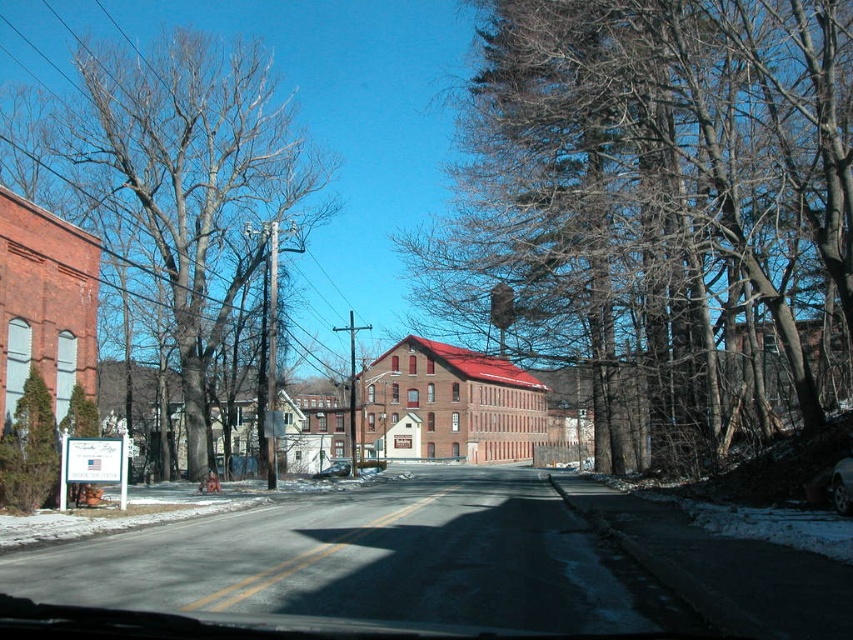
Question: Among these points, which one is nearest to the camera?

Choices:
 (A) (251, 96)
 (B) (837, 500)
 (C) (331, 476)

Answer: (B)

Question: Does brown bark tree at left have a smaller size compared to shiny black car at center?

Choices:
 (A) yes
 (B) no

Answer: (B)

Question: Does bare branches at right appear on the right side of shiny black sedan at center?

Choices:
 (A) no
 (B) yes

Answer: (B)

Question: Is shiny black car at center in front of shiny black sedan at center?

Choices:
 (A) yes
 (B) no

Answer: (A)

Question: Which point is closer to the camera?

Choices:
 (A) shiny black sedan at center
 (B) bare branches at right
 (C) shiny black car at center

Answer: (C)

Question: Which point is closer to the camera?

Choices:
 (A) (311, 477)
 (B) (750, 280)

Answer: (B)